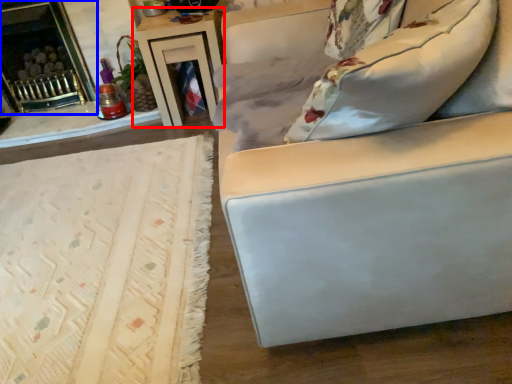
Question: Among these objects, which one is nearest to the camera, table (highlighted by a red box) or fireplace (highlighted by a blue box)?

Choices:
 (A) table
 (B) fireplace

Answer: (A)